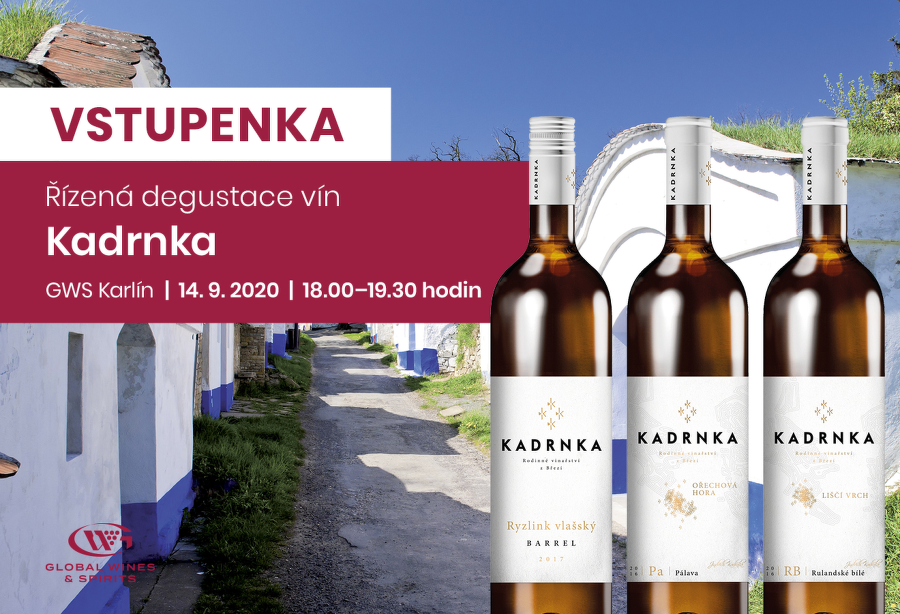
Where is `wine bottle`? The width and height of the screenshot is (900, 614). wine bottle is located at coordinates (547, 344), (685, 317), (832, 344).